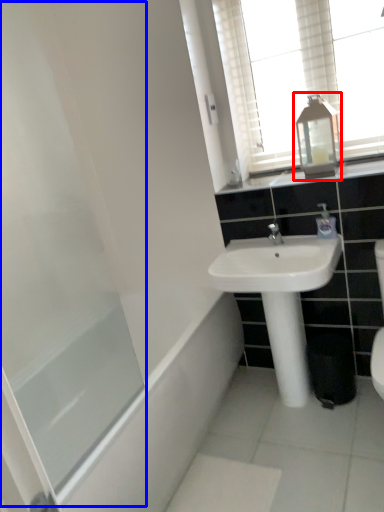
Question: Which point is further to the camera, medicine cabinet (highlighted by a red box) or screen door (highlighted by a blue box)?

Choices:
 (A) medicine cabinet
 (B) screen door

Answer: (A)